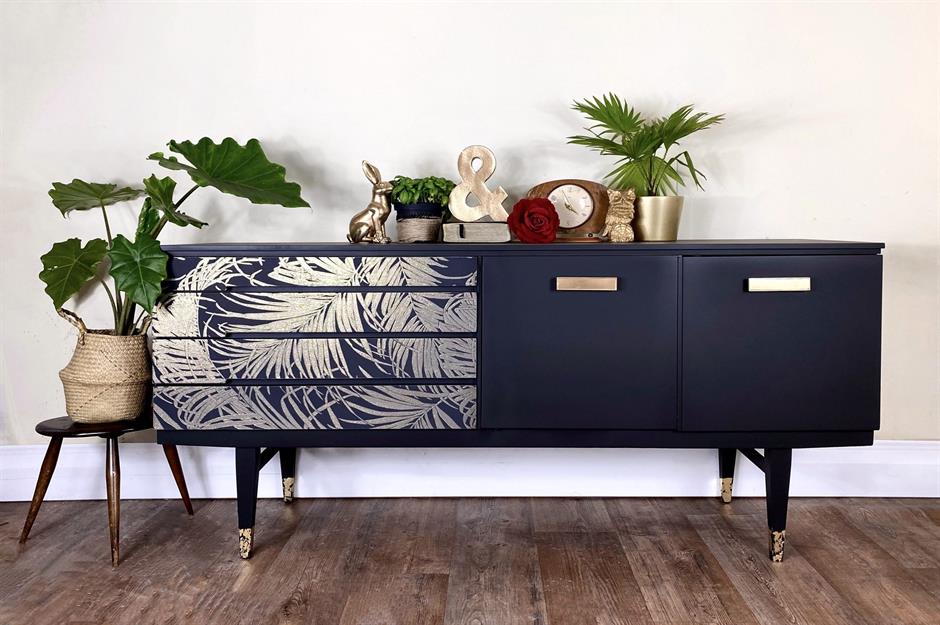
Find the location of a particular element. The image size is (940, 625). stool is located at coordinates (55, 421).